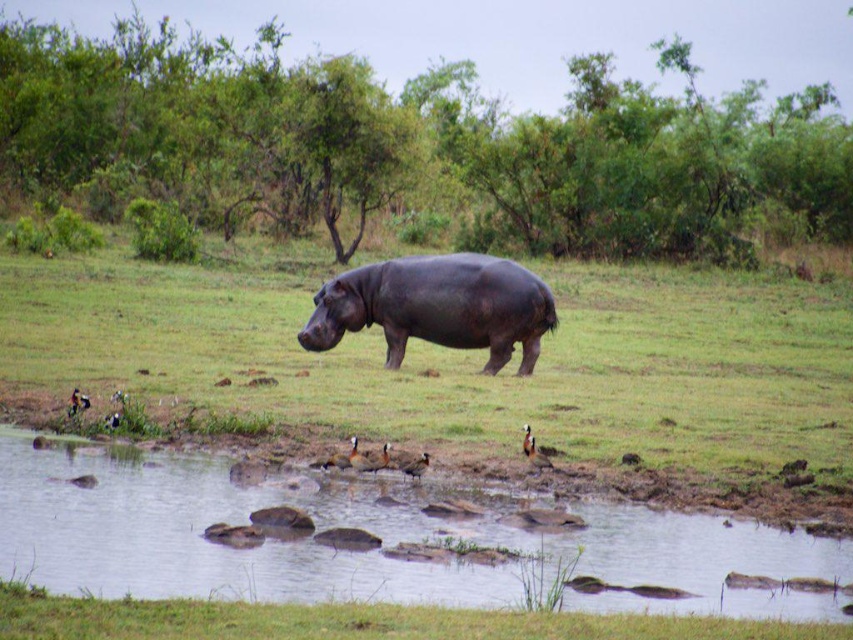
You are a drone operator trying to capture a photo of the hippopotamus in the scene. The drone is currently hovering at point coordinates of 0.5, 0.5. To avoid capturing the dark green grass at center in the photo, which direction should you move the drone? Please answer with either up, down, left, or right.

The dark green grass at center is located at point coordinates of (463,358). Since the drone is at (426,320), moving it slightly to the left and down would position it away from the grass. However, to ensure the grass is not in the frame, moving the drone to the left and down would be the best direction.

You are a wildlife photographer aiming to capture a closeup shot of the clear water at pond center. Your camera has a maximum focus range of 30 feet. Can you take the photo without moving closer?

The clear water at pond center is 27.47 feet away from the camera, which is within the maximum focus range of 30 feet. Therefore, you can take the photo without moving closer.

From the picture: You are a photographer trying to capture the dark brown matte hippo at center and the clear water at pond center in a single frame. Which object should you focus on first if you want to include both in your photo without zooming in or out?

The dark brown matte hippo at center is larger than the clear water at pond center, so you should focus on the dark brown matte hippo at center first to ensure it fits within the frame before adjusting for the smaller clear water at pond center.